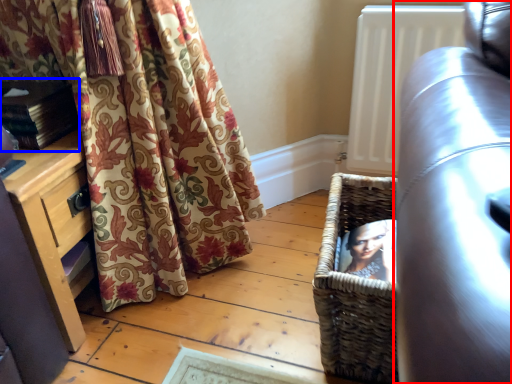
Question: Which object is closer to the camera taking this photo, studio couch (highlighted by a red box) or book (highlighted by a blue box)?

Choices:
 (A) studio couch
 (B) book

Answer: (A)